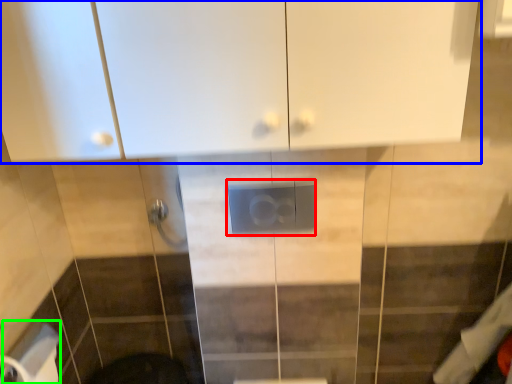
Question: Estimate the real-world distances between objects in this image. Which object is farther from electric outlet (highlighted by a red box), cabinetry (highlighted by a blue box) or toilet paper (highlighted by a green box)?

Choices:
 (A) cabinetry
 (B) toilet paper

Answer: (B)